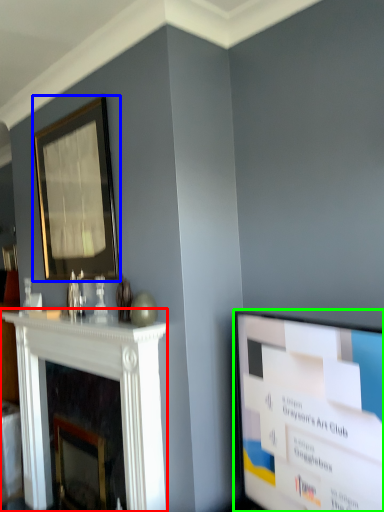
Question: Which object is positioned closest to fireplace (highlighted by a red box)? Select from picture frame (highlighted by a blue box) and television (highlighted by a green box).

Choices:
 (A) picture frame
 (B) television

Answer: (A)